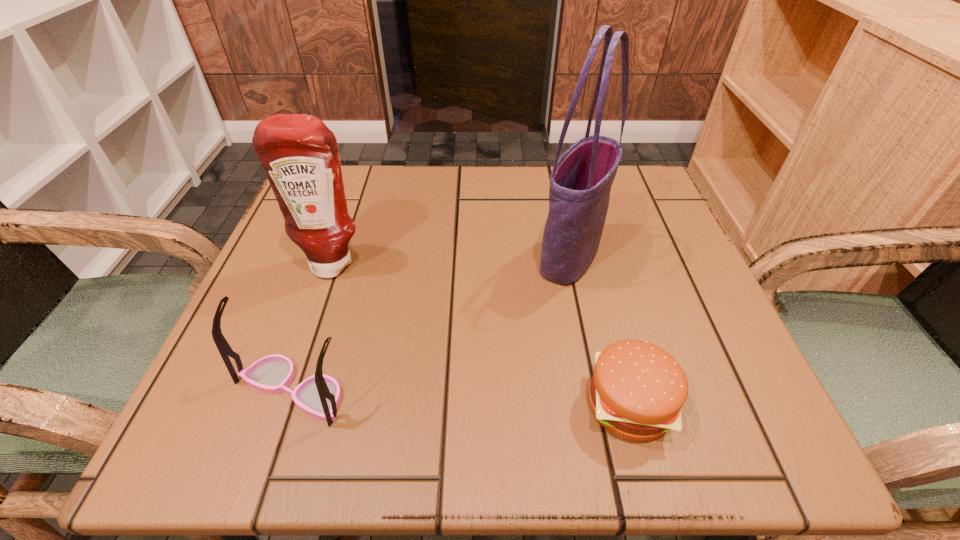
Locate an element on the screen. tote bag is located at coordinates (580, 182).

Image resolution: width=960 pixels, height=540 pixels. I want to click on the second tallest object, so click(x=299, y=153).

In order to click on spectacles in this screenshot , I will do `click(319, 395)`.

Where is `hamburger`? hamburger is located at coordinates (637, 389).

Identify the location of vacant area situated on the left of the tallest object. click(332, 255).

You are a GUI agent. You are given a task and a screenshot of the screen. Output one action in this format:
    pyautogui.click(x=<x>, y=<y>)
    Task: Click on the blank space located on the back of the third shortest object
    The image size is (960, 540).
    Given the screenshot: What is the action you would take?
    tap(349, 217)

I want to click on vacant space situated on the right of the third tallest object, so click(x=440, y=390).

Locate an element on the screen. The width and height of the screenshot is (960, 540). vacant space located on the back of the shortest object is located at coordinates (581, 221).

You are a GUI agent. You are given a task and a screenshot of the screen. Output one action in this format:
    pyautogui.click(x=<x>, y=<y>)
    Task: Click on the object that is at the far edge
    
    Given the screenshot: What is the action you would take?
    pyautogui.click(x=580, y=182)

Identify the location of spectacles situated at the near edge. This screenshot has width=960, height=540. (319, 395).